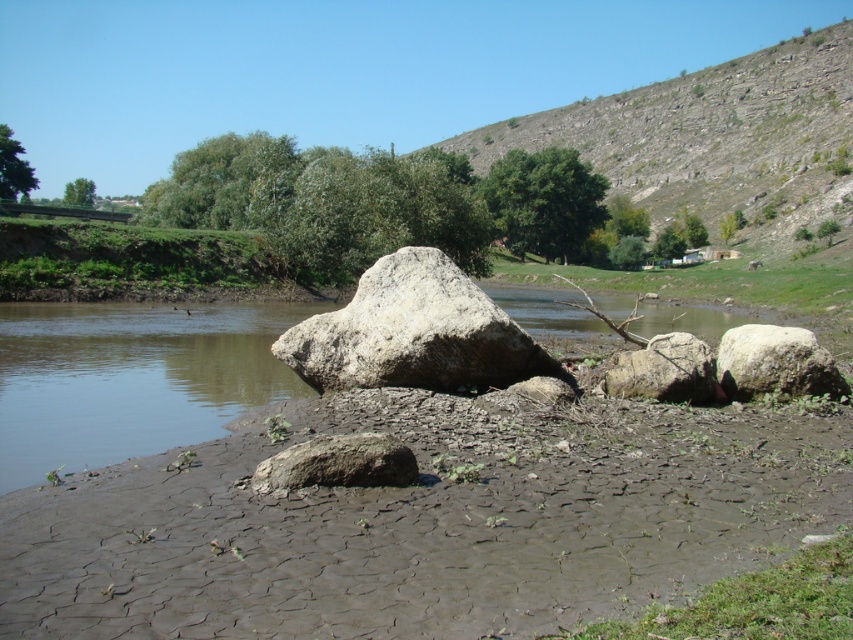
You are a geologist examining the riverside scene. You need to determine which object has a larger width between the white rough boulder at center and the gray rough rock at lower center. Based on the scene, can you make this determination?

The white rough boulder at center might be wider than gray rough rock at lower center, so it is possible that the white rough boulder at center has a larger width.

You are a geologist examining the riverside scene. You notice the dull gray mud at lower center and the gray rough rock at lower center. Which of these two objects is closer to your current position?

The dull gray mud at lower center is closer to your current position because it is in front of the gray rough rock at lower center.